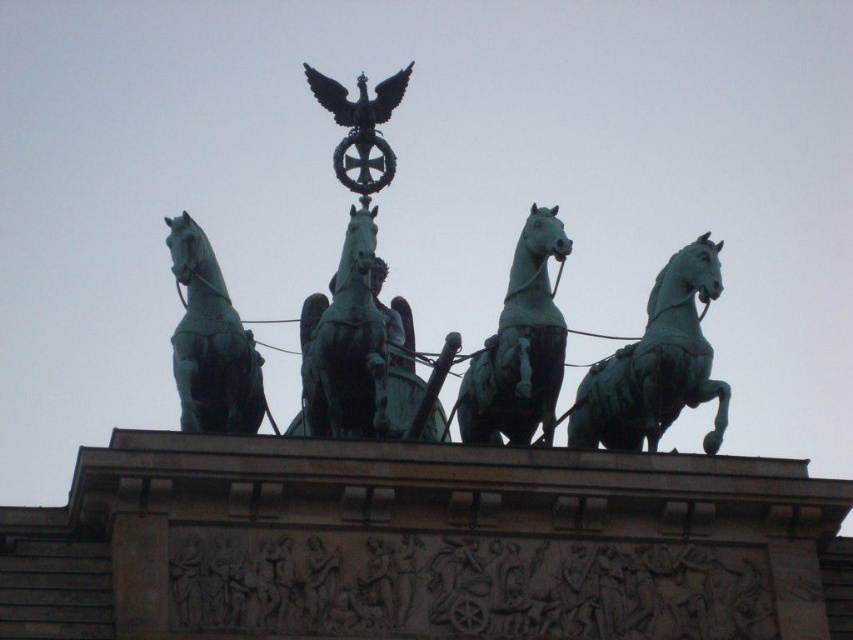
The width and height of the screenshot is (853, 640). What do you see at coordinates (360, 349) in the screenshot?
I see `green polished bronze chariot at center` at bounding box center [360, 349].

Is green polished bronze chariot at center shorter than green polished metal horse at left?

In fact, green polished bronze chariot at center may be taller than green polished metal horse at left.

Image resolution: width=853 pixels, height=640 pixels. Identify the location of green polished bronze chariot at center. pyautogui.click(x=360, y=349).

Locate an element on the screen. The height and width of the screenshot is (640, 853). green polished bronze chariot at center is located at coordinates (360, 349).

Between green polished metal horse at center and green polished metal horse at left, which one appears on the left side from the viewer's perspective?

Positioned to the left is green polished metal horse at left.

Between green polished metal horse at center and green polished metal horse at left, which one has less height?

With less height is green polished metal horse at left.

Between point (527, 266) and point (207, 358), which one is positioned behind?

The point (527, 266) is behind.

Find the location of `green polished metal horse at center`. green polished metal horse at center is located at coordinates (519, 346).

Measure the distance between green polished bronze chariot at center and green polished metal horse at right.

They are 13.53 meters apart.

Measure the distance from green polished bronze chariot at center to green polished metal horse at right.

A distance of 13.53 meters exists between green polished bronze chariot at center and green polished metal horse at right.

Which is in front, point (318, 310) or point (608, 424)?

Point (608, 424)

Locate an element on the screen. green polished bronze chariot at center is located at coordinates (360, 349).